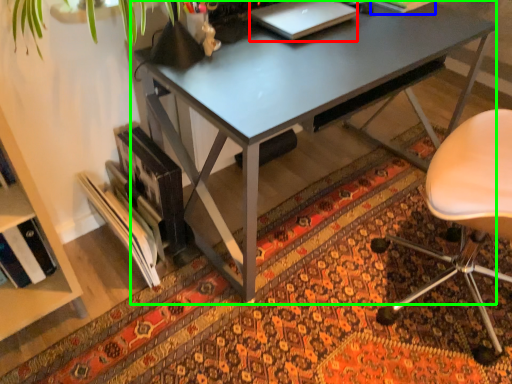
Question: Based on their relative distances, which object is nearer to laptop (highlighted by a red box)? Choose from book (highlighted by a blue box) and desk (highlighted by a green box).

Choices:
 (A) book
 (B) desk

Answer: (B)